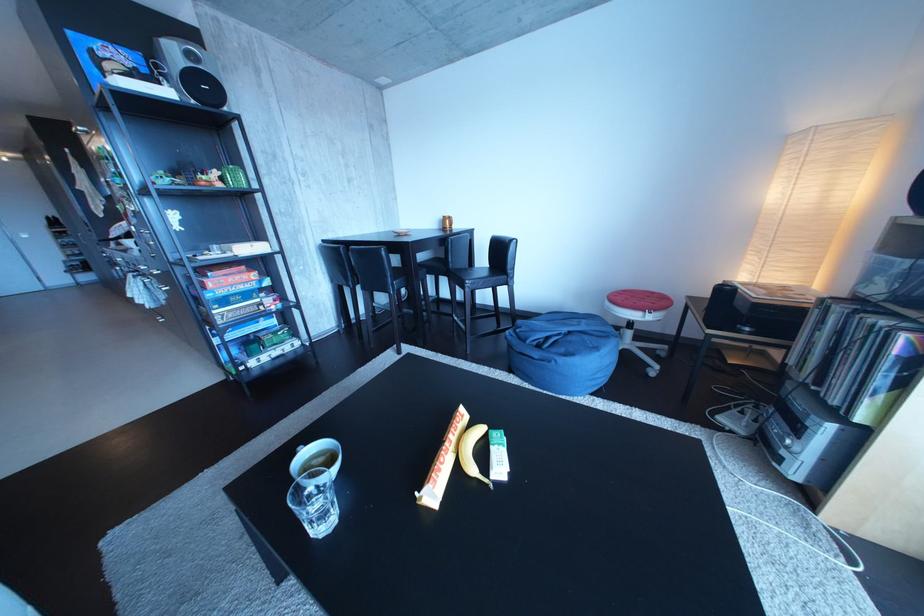
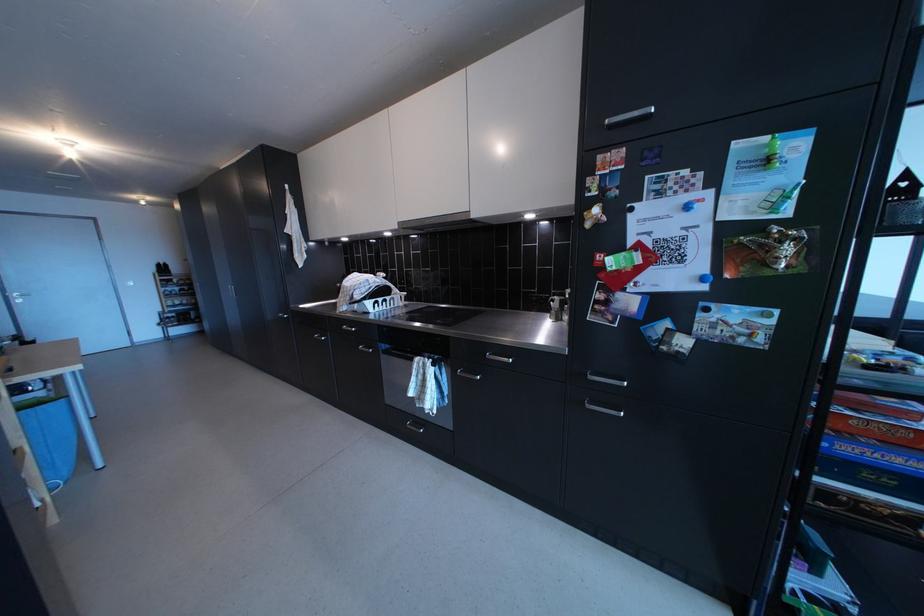
Question: What movement of the cameraman would produce the second image?

Choices:
 (A) Left
 (B) Right
 (C) Forward
 (D) Backward

Answer: (A)